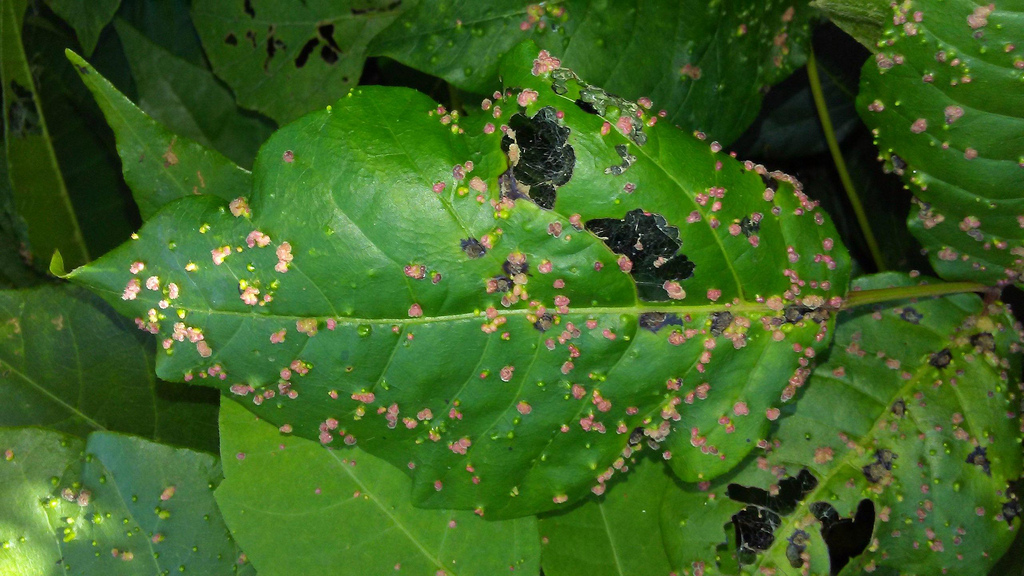
Locate an element on the screen. light is located at coordinates (60, 510), (10, 557).